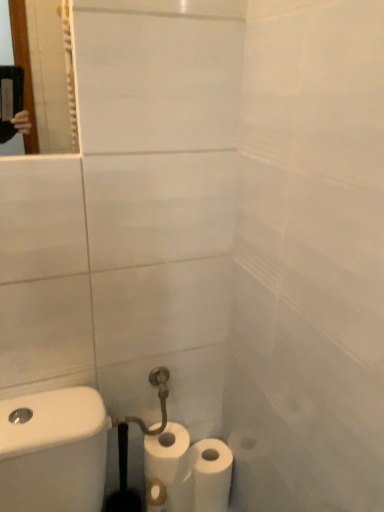
Question: Based on their sizes in the image, would you say white matte toilet paper at lower center, the second toilet paper viewed from the left, is bigger or smaller than white matte toilet paper at lower center, the second toilet paper viewed from the right?

Choices:
 (A) big
 (B) small

Answer: (B)

Question: Is white matte toilet paper at lower center, arranged as the first toilet paper when viewed from the right, inside the boundaries of white matte toilet paper at lower center, the second toilet paper viewed from the right, or outside?

Choices:
 (A) outside
 (B) inside

Answer: (A)

Question: From a real-world perspective, is white matte toilet paper at lower center, the second toilet paper viewed from the left, above or below white matte toilet paper at lower center, the 1th toilet paper in the left-to-right sequence?

Choices:
 (A) above
 (B) below

Answer: (B)

Question: From the image's perspective, is white matte toilet paper at lower center, the second toilet paper viewed from the right, located above or below white matte toilet paper at lower center, arranged as the first toilet paper when viewed from the right?

Choices:
 (A) above
 (B) below

Answer: (A)

Question: Considering their positions, is white matte toilet paper at lower center, the 1th toilet paper in the left-to-right sequence, located in front of or behind white matte toilet paper at lower center, the second toilet paper viewed from the left?

Choices:
 (A) behind
 (B) front

Answer: (B)

Question: Would you say white matte toilet paper at lower center, the second toilet paper viewed from the right, is to the left or to the right of white matte toilet paper at lower center, arranged as the first toilet paper when viewed from the right, in the picture?

Choices:
 (A) right
 (B) left

Answer: (B)

Question: From their relative heights in the image, would you say white matte toilet paper at lower center, the second toilet paper viewed from the right, is taller or shorter than white matte toilet paper at lower center, the second toilet paper viewed from the left?

Choices:
 (A) tall
 (B) short

Answer: (A)